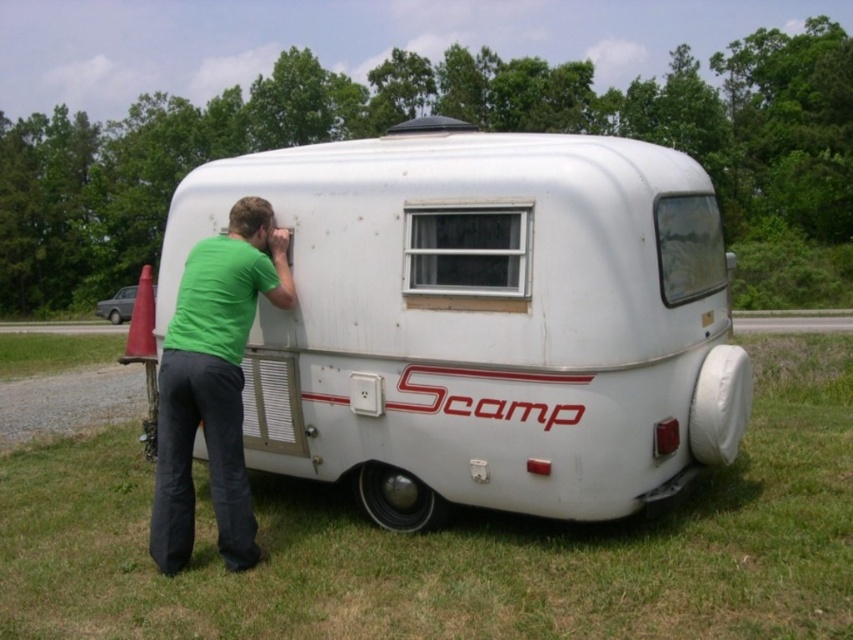
Question: Does green grass at lower center come behind white matte trailer at lower left?

Choices:
 (A) no
 (B) yes

Answer: (A)

Question: From the image, what is the correct spatial relationship of green grass at lower center in relation to green matte shirt at lower left?

Choices:
 (A) below
 (B) above

Answer: (A)

Question: Which object is positioned farthest from the white matte trailer at lower left?

Choices:
 (A) green grass at lower center
 (B) green matte shirt at lower left
 (C) white matte recreational vehicle at center

Answer: (A)

Question: Considering the relative positions of white matte recreational vehicle at center and white matte trailer at lower left in the image provided, where is white matte recreational vehicle at center located with respect to white matte trailer at lower left?

Choices:
 (A) above
 (B) below

Answer: (B)

Question: Which is nearer to the white matte recreational vehicle at center?

Choices:
 (A) white matte trailer at lower left
 (B) green matte shirt at lower left

Answer: (B)

Question: Estimate the real-world distances between objects in this image. Which object is closer to the green matte shirt at lower left?

Choices:
 (A) white matte trailer at lower left
 (B) green grass at lower center
 (C) white matte recreational vehicle at center

Answer: (C)